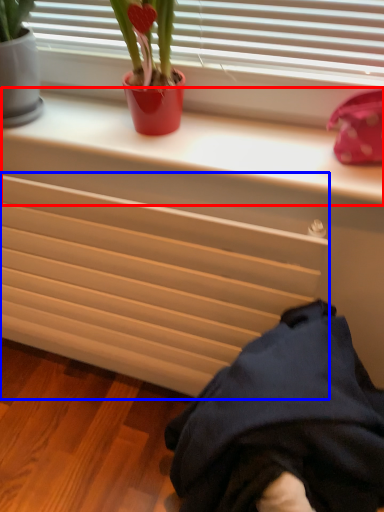
Question: Which object appears farthest to the camera in this image, window sill (highlighted by a red box) or radiator (highlighted by a blue box)?

Choices:
 (A) window sill
 (B) radiator

Answer: (B)